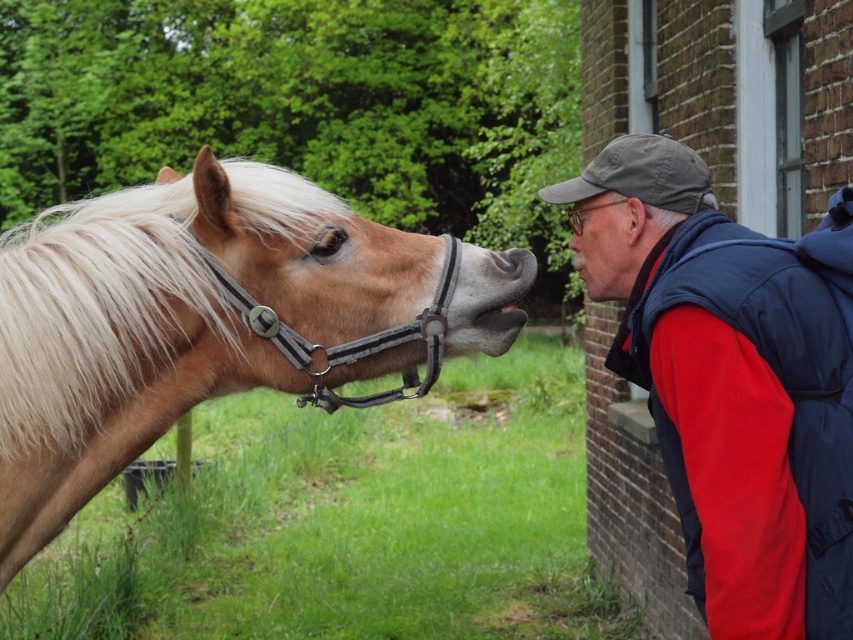
Is blonde mane and bridle at left further to camera compared to light brown leather bridle at center?

No, blonde mane and bridle at left is in front of light brown leather bridle at center.

Is point (265, 273) positioned in front of point (318, 346)?

No, it is behind (318, 346).

Is point (167, 224) closer to camera compared to point (310, 374)?

Yes, point (167, 224) is in front of point (310, 374).

The height and width of the screenshot is (640, 853). In order to click on blonde mane and bridle at left in this screenshot , I will do 212,321.

Which is in front, point (361, 272) or point (57, 400)?

Positioned in front is point (57, 400).

Is blonde mane and bridle at left bigger than blonde silky mane at left?

Correct, blonde mane and bridle at left is larger in size than blonde silky mane at left.

Describe the element at coordinates (212, 321) in the screenshot. I see `blonde mane and bridle at left` at that location.

What are the coordinates of `blonde mane and bridle at left` in the screenshot? It's located at (212, 321).

Locate an element on the screen. blonde mane and bridle at left is located at coordinates [x=212, y=321].

Between blonde mane and bridle at left and matte skin nose at center, which one appears on the right side from the viewer's perspective?

From the viewer's perspective, matte skin nose at center appears more on the right side.

Is point (131, 237) positioned in front of point (577, 241)?

Yes, point (131, 237) is in front of point (577, 241).

Identify the location of blonde mane and bridle at left. This screenshot has width=853, height=640. (212, 321).